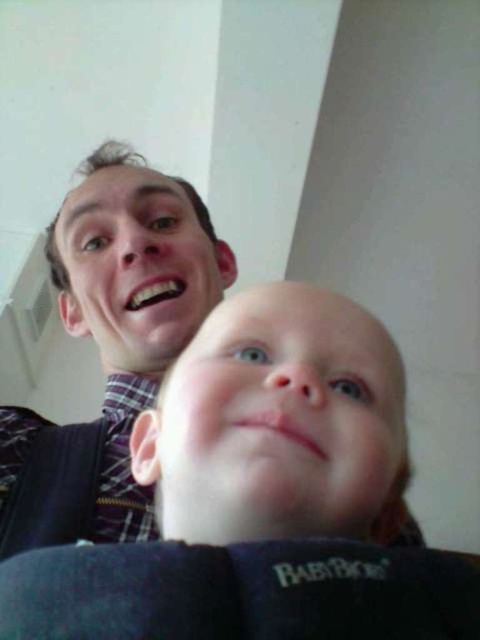
You are a photographer trying to focus on the smooth skin baby at center and the matte plaid shirt at upper left. Which one is closer to the camera?

The smooth skin baby at center is closer to the camera than the matte plaid shirt at upper left because it is in front of it.

You are a photographer trying to frame a shot of the smooth skin baby at center and the matte plaid shirt at upper left. Based on their sizes, which object should you focus on to ensure it fits entirely within the camera frame?

The smooth skin baby at center has a smaller width than the matte plaid shirt at upper left, so focusing on the matte plaid shirt at upper left ensures it fits entirely within the camera frame.